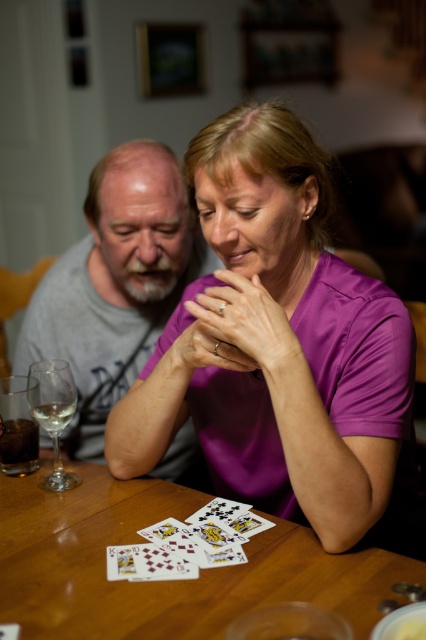
Question: Does purple satin shirt at center appear under gray cotton shirt at left?

Choices:
 (A) yes
 (B) no

Answer: (A)

Question: Does wooden table at center appear on the right side of cardboard playing cards at center?

Choices:
 (A) no
 (B) yes

Answer: (A)

Question: Which point is farther to the camera?

Choices:
 (A) (302, 310)
 (B) (184, 538)
 (C) (46, 384)

Answer: (C)

Question: Is cardboard playing cards at center closer to the viewer compared to clear glass wine glass at left?

Choices:
 (A) yes
 (B) no

Answer: (A)

Question: Which of these objects is positioned closest to the clear glass wine glass at left?

Choices:
 (A) purple satin shirt at center
 (B) wooden table at center
 (C) gray cotton shirt at left

Answer: (B)

Question: Among these points, which one is farthest from the camera?

Choices:
 (A) (206, 579)
 (B) (138, 282)

Answer: (B)